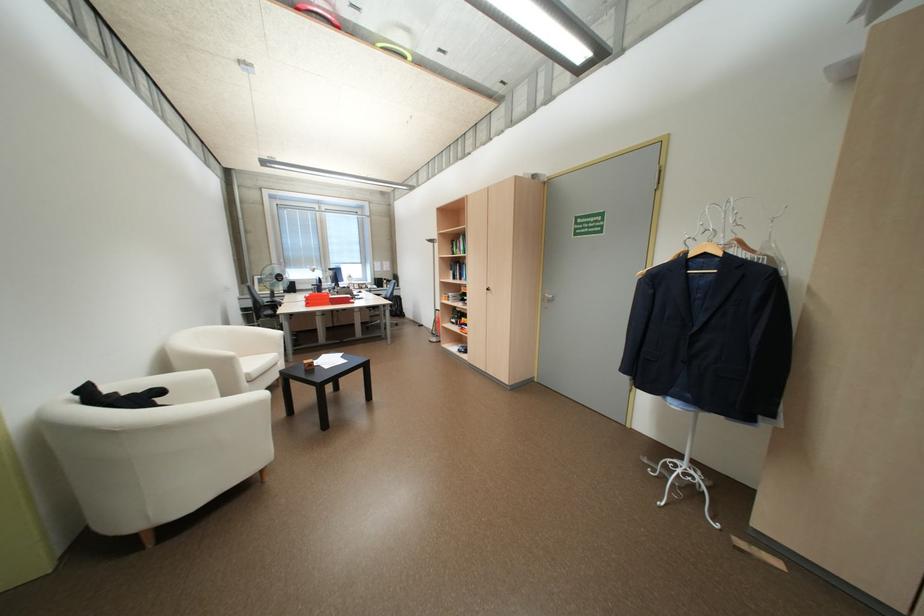
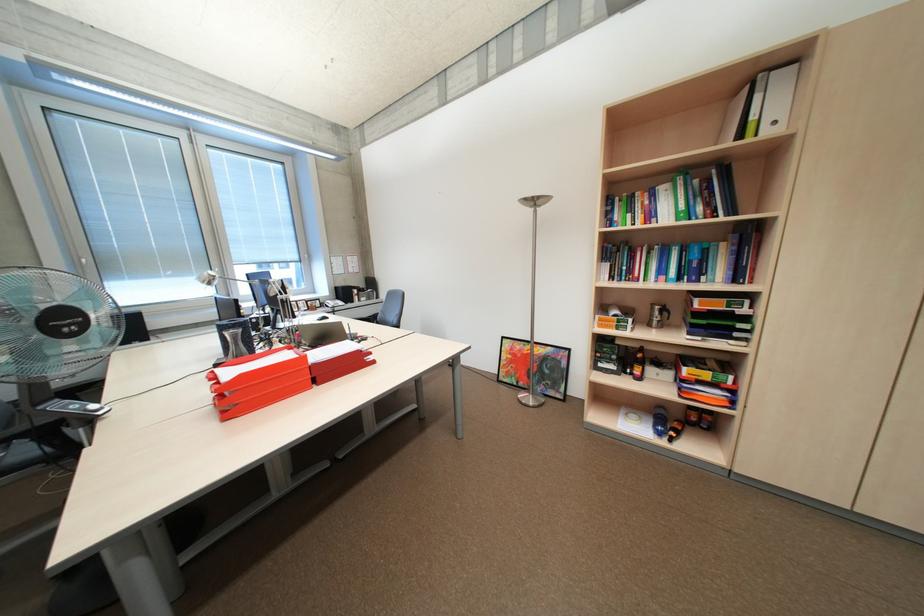
In the second image, find the point that corresponds to (x=469, y=249) in the first image.

(661, 215)